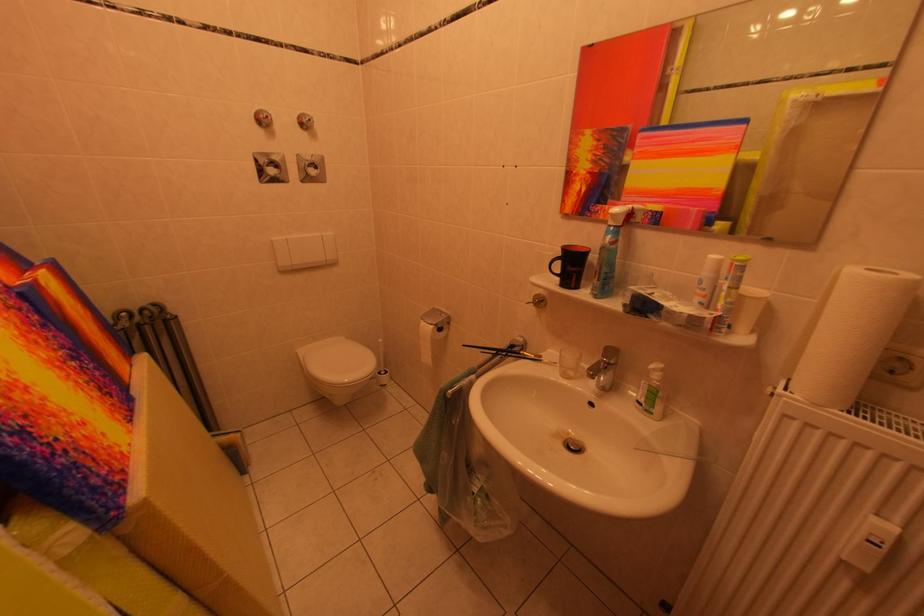
Find where to press the blue spray bottle trigger. Please return your answer as a coordinate pair (x, y).

(608, 252)